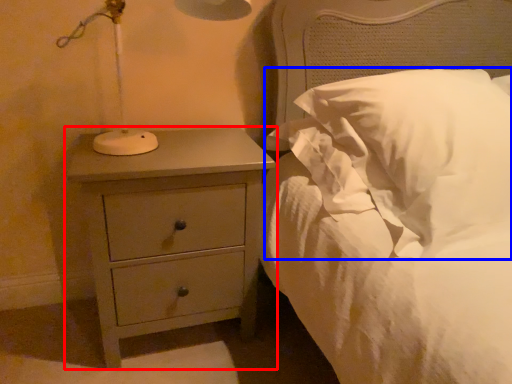
Question: Which object appears farthest to the camera in this image, chest of drawers (highlighted by a red box) or pillow (highlighted by a blue box)?

Choices:
 (A) chest of drawers
 (B) pillow

Answer: (A)